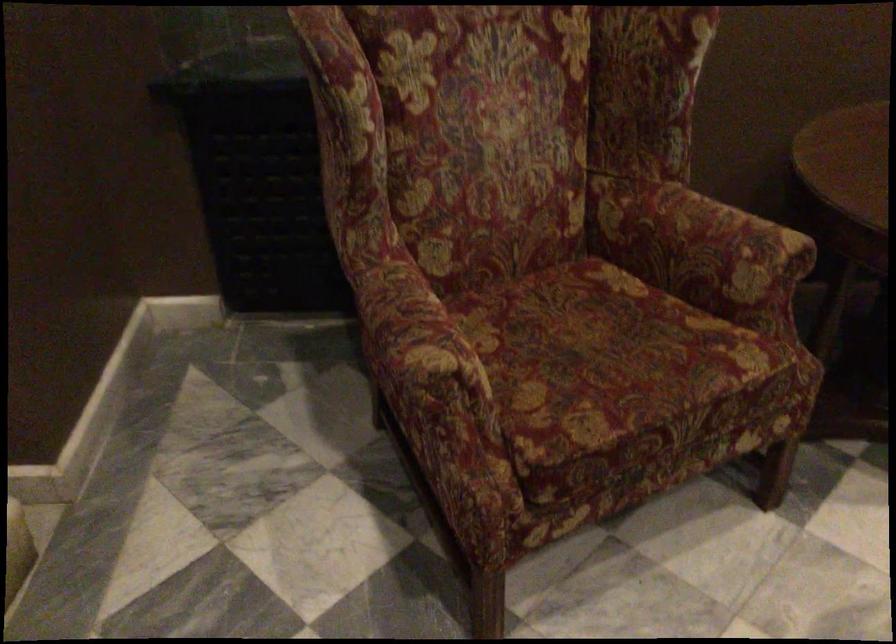
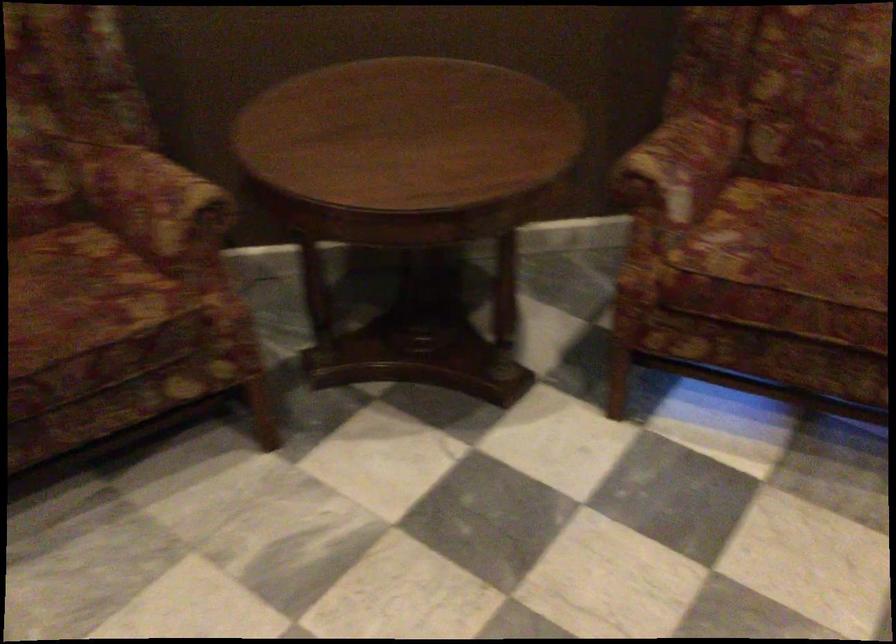
Question: What movement of the cameraman would produce the second image?

Choices:
 (A) Left
 (B) Right
 (C) Forward
 (D) Backward

Answer: (B)